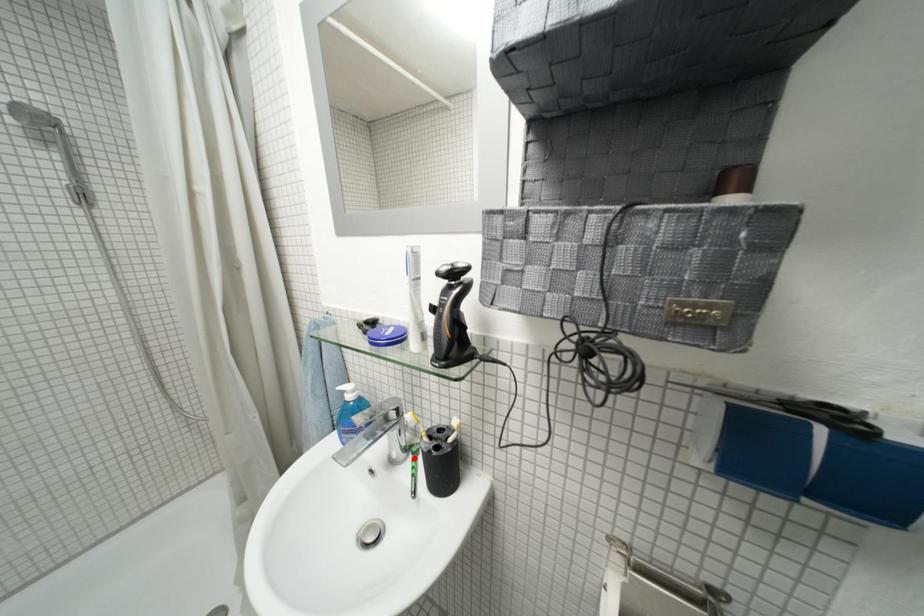
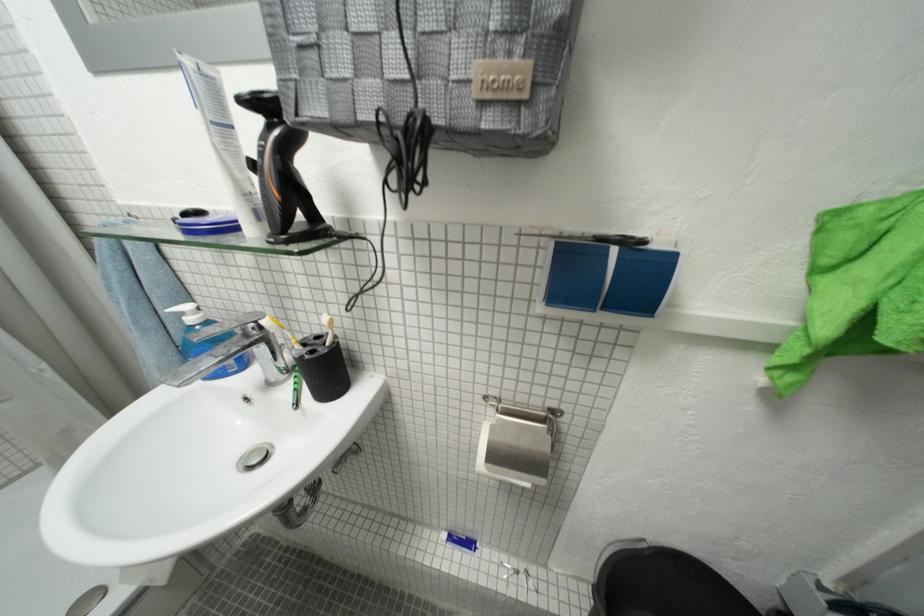
Where in the second image is the point corresponding to the highlighted location from the first image?

(296, 378)